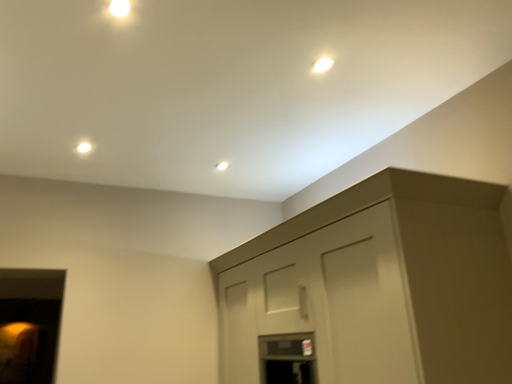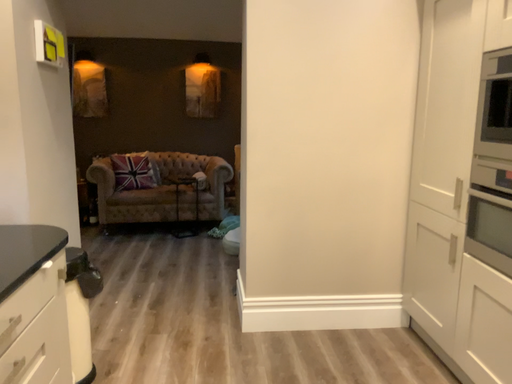
Question: How did the camera likely rotate when shooting the video?

Choices:
 (A) rotated downward
 (B) rotated upward

Answer: (A)